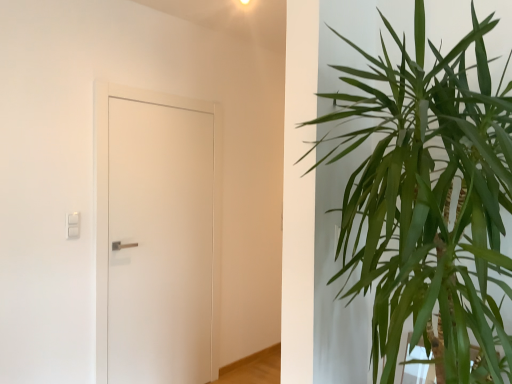
Where is `green leafy plant at right`? This screenshot has width=512, height=384. green leafy plant at right is located at coordinates (428, 202).

What do you see at coordinates (428, 202) in the screenshot?
I see `green leafy plant at right` at bounding box center [428, 202].

Describe the element at coordinates (156, 236) in the screenshot. This screenshot has width=512, height=384. I see `white matte door at left` at that location.

Find the location of a particular element. This screenshot has width=512, height=384. white matte door at left is located at coordinates (156, 236).

Image resolution: width=512 pixels, height=384 pixels. In order to click on green leafy plant at right in this screenshot , I will do `click(428, 202)`.

Which object is positioned more to the left, white matte door at left or green leafy plant at right?

white matte door at left is more to the left.

Considering the positions of objects white matte door at left and green leafy plant at right in the image provided, who is in front, white matte door at left or green leafy plant at right?

green leafy plant at right.

Is point (108, 124) in front of point (424, 165)?

No, (108, 124) is behind (424, 165).

From the image's perspective, is white matte door at left located above or below green leafy plant at right?

white matte door at left is below green leafy plant at right.

From a real-world perspective, between white matte door at left and green leafy plant at right, who is vertically lower?

white matte door at left.

Which object is thinner, white matte door at left or green leafy plant at right?

white matte door at left.

Which of these two, white matte door at left or green leafy plant at right, stands taller?

white matte door at left.

From the picture: Considering the relative sizes of white matte door at left and green leafy plant at right in the image provided, is white matte door at left bigger than green leafy plant at right?

No, white matte door at left is not bigger than green leafy plant at right.

Would you say white matte door at left is inside or outside green leafy plant at right?

white matte door at left is located beyond the bounds of green leafy plant at right.

Is white matte door at left placed right next to green leafy plant at right?

No, white matte door at left is not beside green leafy plant at right.

Is white matte door at left facing away from green leafy plant at right?

That's not correct — white matte door at left is not looking away from green leafy plant at right.

You are a GUI agent. You are given a task and a screenshot of the screen. Output one action in this format:
    pyautogui.click(x=<x>, y=<y>)
    Task: Click on the door located on the left of green leafy plant at right
    The height and width of the screenshot is (384, 512).
    Given the screenshot: What is the action you would take?
    pyautogui.click(x=156, y=236)

In the image, is green leafy plant at right on the left side or the right side of white matte door at left?

Based on their positions, green leafy plant at right is located to the right of white matte door at left.

Which is behind, green leafy plant at right or white matte door at left?

white matte door at left is more distant.

Which is closer, (398, 317) or (173, 120)?

Point (398, 317).

From the image's perspective, would you say green leafy plant at right is shown under white matte door at left?

No, from the image's perspective, green leafy plant at right is not beneath white matte door at left.

From a real-world perspective, is green leafy plant at right above or below white matte door at left?

In terms of real-world spatial position, green leafy plant at right is above white matte door at left.

Can you confirm if green leafy plant at right is wider than white matte door at left?

Yes.

Considering the sizes of green leafy plant at right and white matte door at left in the image, is green leafy plant at right taller or shorter than white matte door at left?

Considering their sizes, green leafy plant at right has less height than white matte door at left.

Between green leafy plant at right and white matte door at left, which one has larger size?

green leafy plant at right.

Is green leafy plant at right positioned beyond the bounds of white matte door at left?

green leafy plant at right lies outside white matte door at left's area.

Is green leafy plant at right in contact with white matte door at left?

green leafy plant at right and white matte door at left are not in contact.

Is green leafy plant at right facing away from white matte door at left?

That's not correct — green leafy plant at right is not looking away from white matte door at left.

How far apart are green leafy plant at right and white matte door at left?

1.71 meters.

In order to click on houseplant in front of the white matte door at left in this screenshot , I will do `click(428, 202)`.

The width and height of the screenshot is (512, 384). I want to click on houseplant located above the white matte door at left (from the image's perspective), so click(x=428, y=202).

Locate an element on the screen. door that appears on the left of green leafy plant at right is located at coordinates (156, 236).